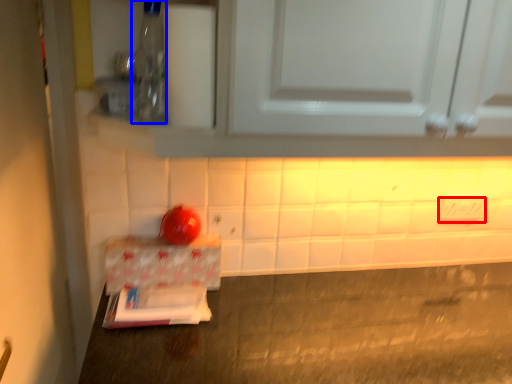
Question: Which object is closer to the camera taking this photo, electric outlet (highlighted by a red box) or bottle (highlighted by a blue box)?

Choices:
 (A) electric outlet
 (B) bottle

Answer: (B)